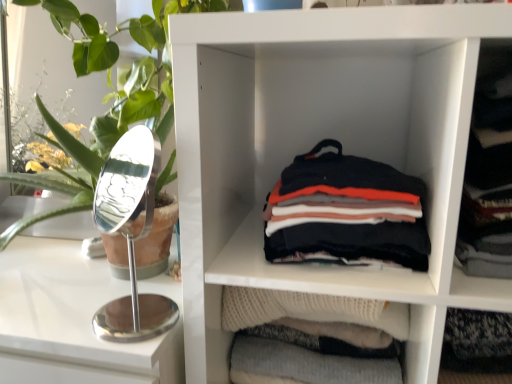
What do you see at coordinates (488, 172) in the screenshot? I see `dark gray sweater at right` at bounding box center [488, 172].

This screenshot has width=512, height=384. Find the location of `green leafy plant at left`. green leafy plant at left is located at coordinates (112, 94).

The image size is (512, 384). Describe the element at coordinates (71, 321) in the screenshot. I see `white glossy counter at left` at that location.

Where is `dark gray sweater at right`? The height and width of the screenshot is (384, 512). dark gray sweater at right is located at coordinates (488, 172).

Is green leafy plant at left located within white glossy counter at left?

No, white glossy counter at left does not contain green leafy plant at left.

Considering the relative sizes of white glossy counter at left and green leafy plant at left in the image provided, is white glossy counter at left bigger than green leafy plant at left?

Yes.

Who is taller, white glossy counter at left or green leafy plant at left?

Standing taller between the two is green leafy plant at left.

Is green leafy plant at left turned away from soft cotton shirts at center?

green leafy plant at left does not have its back to soft cotton shirts at center.

Is green leafy plant at left situated inside soft cotton shirts at center or outside?

The correct answer is: outside.

This screenshot has height=384, width=512. What are the coordinates of `plant above the soft cotton shirts at center (from a real-world perspective)` in the screenshot? It's located at (112, 94).

Which object is thinner, green leafy plant at left or soft cotton shirts at center?

With smaller width is soft cotton shirts at center.

Which of these two, dark gray sweater at right or white glossy counter at left, is bigger?

white glossy counter at left is bigger.

Relative to white glossy counter at left, is dark gray sweater at right in front or behind?

dark gray sweater at right is in front of white glossy counter at left.

Between point (496, 200) and point (68, 341), which one is positioned behind?

Point (68, 341)

Is soft cotton shirts at center positioned with its back to dark gray sweater at right?

No.

Find the location of a particular element. clothing in front of the soft cotton shirts at center is located at coordinates (488, 172).

Is soft cotton shirts at center taller than dark gray sweater at right?

Incorrect, the height of soft cotton shirts at center is not larger of that of dark gray sweater at right.

Looking at their sizes, would you say white matte shelf at center is wider or thinner than white glossy counter at left?

Considering their sizes, white matte shelf at center looks slimmer than white glossy counter at left.

Which is more to the right, white matte shelf at center or white glossy counter at left?

Positioned to the right is white matte shelf at center.

Is soft cotton shirts at center at the back of white glossy counter at left?

No, white glossy counter at left is not facing away from soft cotton shirts at center.

Is white glossy counter at left closer to camera compared to soft cotton shirts at center?

No, it is not.

From their relative heights in the image, would you say white glossy counter at left is taller or shorter than soft cotton shirts at center?

In the image, white glossy counter at left appears to be taller than soft cotton shirts at center.

Which is more to the right, white glossy counter at left or soft cotton shirts at center?

soft cotton shirts at center.

Based on the photo, visually, is white matte shelf at center positioned to the left or to the right of green leafy plant at left?

Based on their positions, white matte shelf at center is located to the right of green leafy plant at left.

Looking at their sizes, would you say white matte shelf at center is wider or thinner than green leafy plant at left?

In the image, white matte shelf at center appears to be more narrow than green leafy plant at left.

Are white matte shelf at center and green leafy plant at left located far from each other?

white matte shelf at center is near green leafy plant at left, not far away.

Can you confirm if white matte shelf at center is shorter than green leafy plant at left?

Incorrect, the height of white matte shelf at center does not fall short of that of green leafy plant at left.

Locate an element on the screen. This screenshot has width=512, height=384. plant that appears above the white glossy counter at left (from the image's perspective) is located at coordinates (112, 94).

The height and width of the screenshot is (384, 512). What are the coordinates of `plant in front of the soft cotton shirts at center` in the screenshot? It's located at (112, 94).

When comparing their distances from white glossy counter at left, does white matte shelf at center or soft cotton shirts at center seem closer?

white matte shelf at center is positioned closer to the anchor white glossy counter at left.

Estimate the real-world distances between objects in this image. Which object is further from soft cotton shirts at center, dark gray sweater at right or white matte shelf at center?

The object further to soft cotton shirts at center is dark gray sweater at right.

Looking at the image, which one is located further to green leafy plant at left, dark gray sweater at right or white matte shelf at center?

dark gray sweater at right is positioned further to the anchor green leafy plant at left.

Estimate the real-world distances between objects in this image. Which object is further from white matte shelf at center, soft cotton shirts at center or white glossy counter at left?

white glossy counter at left.

When comparing their distances from green leafy plant at left, does dark gray sweater at right or soft cotton shirts at center seem closer?

soft cotton shirts at center is positioned closer to the anchor green leafy plant at left.

Based on their spatial positions, is soft cotton shirts at center or dark gray sweater at right closer to green leafy plant at left?

soft cotton shirts at center is positioned closer to the anchor green leafy plant at left.

When comparing their distances from white glossy counter at left, does white matte shelf at center or green leafy plant at left seem closer?

Among the two, green leafy plant at left is located nearer to white glossy counter at left.

Estimate the real-world distances between objects in this image. Which object is further from dark gray sweater at right, green leafy plant at left or white matte shelf at center?

The object further to dark gray sweater at right is green leafy plant at left.

I want to click on plant between white glossy counter at left and soft cotton shirts at center from left to right, so click(112, 94).

The height and width of the screenshot is (384, 512). I want to click on shelf situated between green leafy plant at left and dark gray sweater at right from left to right, so click(315, 143).

Locate an element on the screen. Image resolution: width=512 pixels, height=384 pixels. plant between white glossy counter at left and white matte shelf at center from left to right is located at coordinates (112, 94).

I want to click on plant situated between white glossy counter at left and dark gray sweater at right from left to right, so click(112, 94).